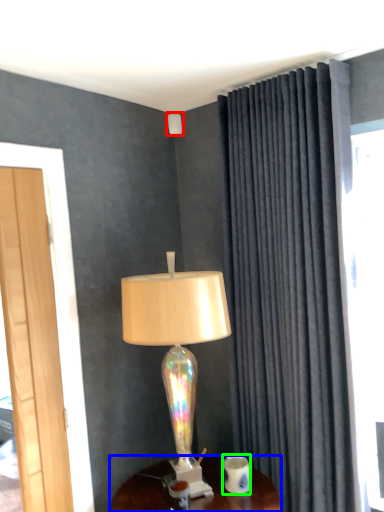
Question: Based on their relative distances, which object is nearer to lamp (highlighted by a red box)? Choose from desk (highlighted by a blue box) and coffee cup (highlighted by a green box).

Choices:
 (A) desk
 (B) coffee cup

Answer: (B)